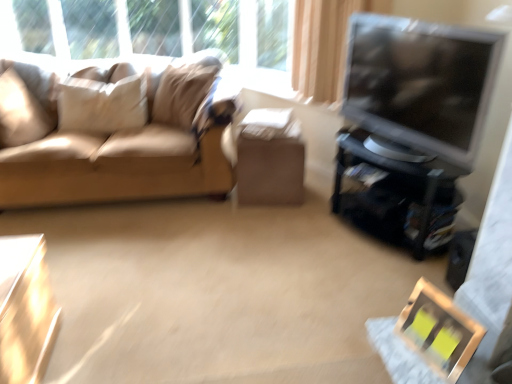
Locate an element on the screen. vacant space that is in between shiny metallic table at lower left, the 2th table viewed from the right, and matte cardboard box at center, placed as the first table when sorted from top to bottom is located at coordinates (172, 263).